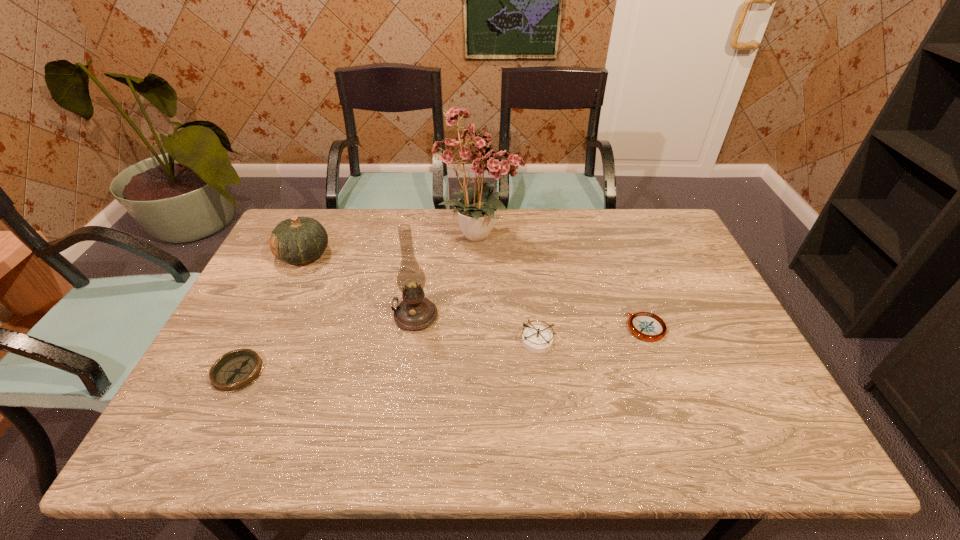
Image resolution: width=960 pixels, height=540 pixels. What are the coordinates of `vacant position at the left edge of the desktop` in the screenshot? It's located at (244, 336).

The image size is (960, 540). In the image, there is a desktop. What are the coordinates of `free space at the right edge` in the screenshot? It's located at 702,325.

The height and width of the screenshot is (540, 960). In order to click on vacant space at the near left corner of the desktop in this screenshot , I will do tap(173, 434).

The image size is (960, 540). I want to click on empty space between the flower arrangement and the oil lamp, so click(x=447, y=275).

Locate an element on the screen. The image size is (960, 540). free space between the rightmost object and the third tallest object is located at coordinates (475, 292).

You are a GUI agent. You are given a task and a screenshot of the screen. Output one action in this format:
    pyautogui.click(x=<x>, y=<y>)
    Task: Click on the vacant space that's between the second tallest object and the tallest object
    This screenshot has height=540, width=960.
    Given the screenshot: What is the action you would take?
    pyautogui.click(x=447, y=275)

This screenshot has width=960, height=540. I want to click on free spot between the rightmost compass and the second tallest object, so click(x=531, y=322).

The height and width of the screenshot is (540, 960). In order to click on vacant space that's between the leftmost compass and the gourd in this screenshot , I will do click(271, 314).

Locate an element on the screen. vacant area that lies between the leftmost compass and the tallest object is located at coordinates (359, 303).

Find the location of a particular element. vacant area that lies between the tallest compass and the rightmost compass is located at coordinates (592, 334).